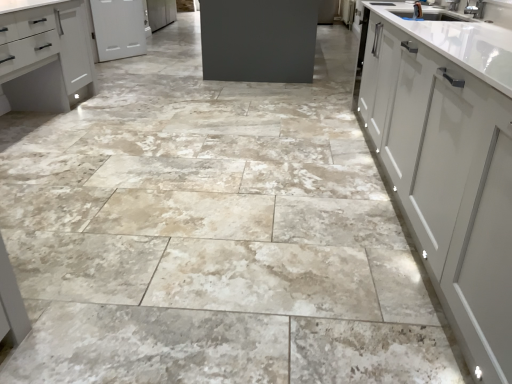
Find the location of `unoccupied region to the right of matte white cabinet at left, which ranks as the 2th cabinetry in back-to-front order`. unoccupied region to the right of matte white cabinet at left, which ranks as the 2th cabinetry in back-to-front order is located at coordinates (133, 126).